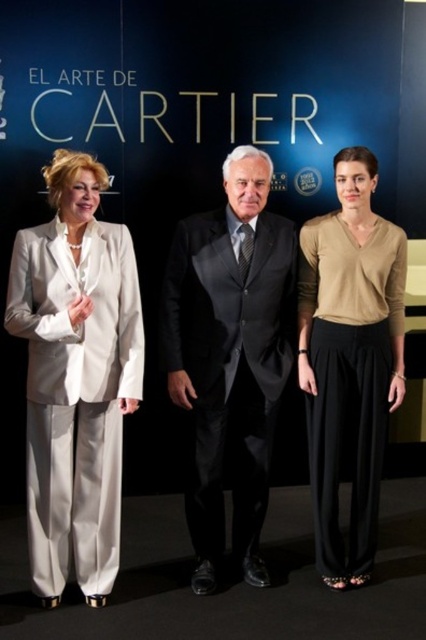
Question: Is matte white suit at left above dark gray suit at center?

Choices:
 (A) yes
 (B) no

Answer: (B)

Question: Does matte white suit at left have a greater width compared to beige soft sweater at center?

Choices:
 (A) yes
 (B) no

Answer: (A)

Question: Which point is farther from the camera taking this photo?

Choices:
 (A) (45, 596)
 (B) (325, 428)
 (C) (296, 259)

Answer: (C)

Question: Which of these objects is positioned farthest from the matte white suit at left?

Choices:
 (A) dark gray suit at center
 (B) beige soft sweater at center

Answer: (B)

Question: Which point is closer to the camera taking this photo?

Choices:
 (A) (69, 280)
 (B) (328, 422)
 (C) (187, 387)

Answer: (A)

Question: Does matte white suit at left appear on the left side of dark gray suit at center?

Choices:
 (A) yes
 (B) no

Answer: (A)